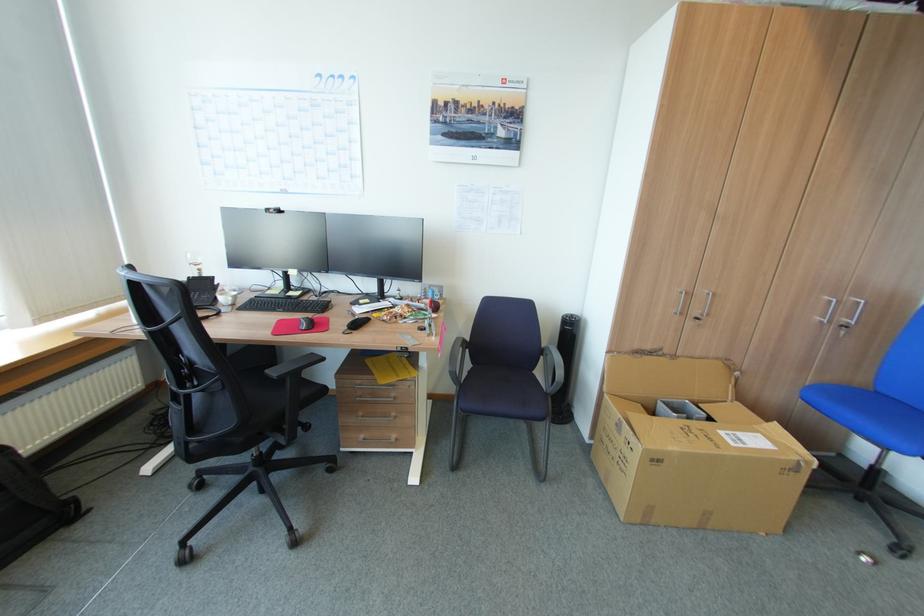
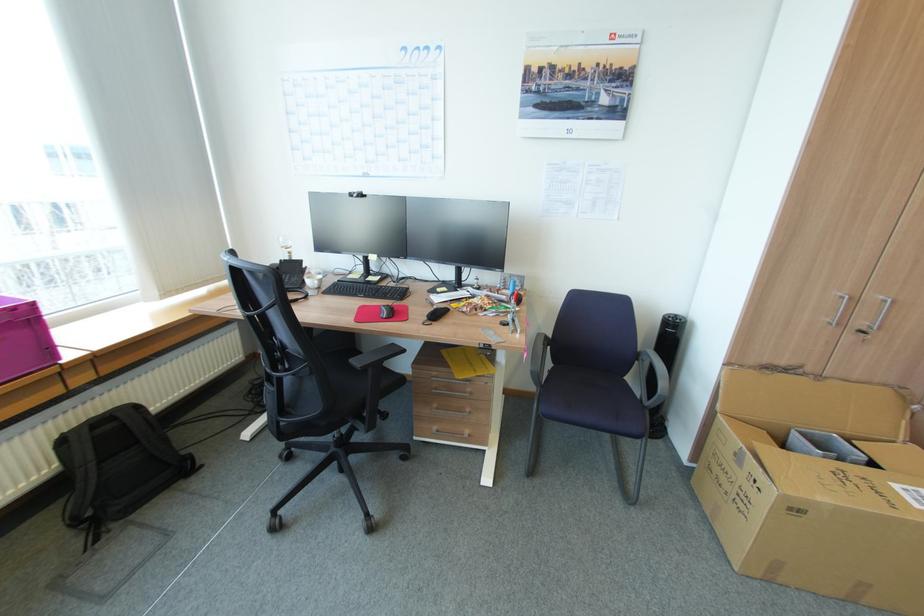
Where in the second image is the point corresponding to point (711, 291) from the first image?

(888, 297)